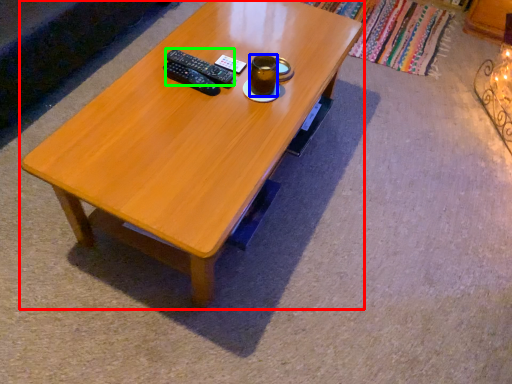
Question: Which is farther away from coffee table (highlighted by a red box)? beverage (highlighted by a blue box) or remote (highlighted by a green box)?

Choices:
 (A) beverage
 (B) remote

Answer: (A)